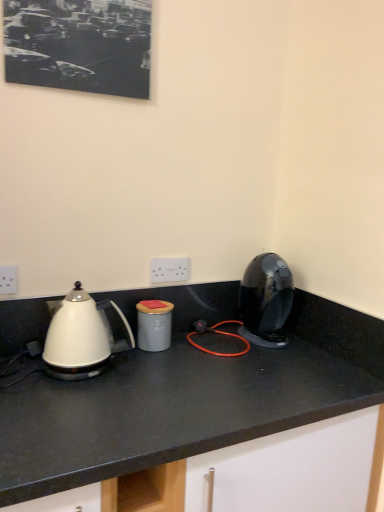
The image size is (384, 512). In order to click on vacant area that is situated to the right of gray matte canister at center in this screenshot , I will do `click(199, 354)`.